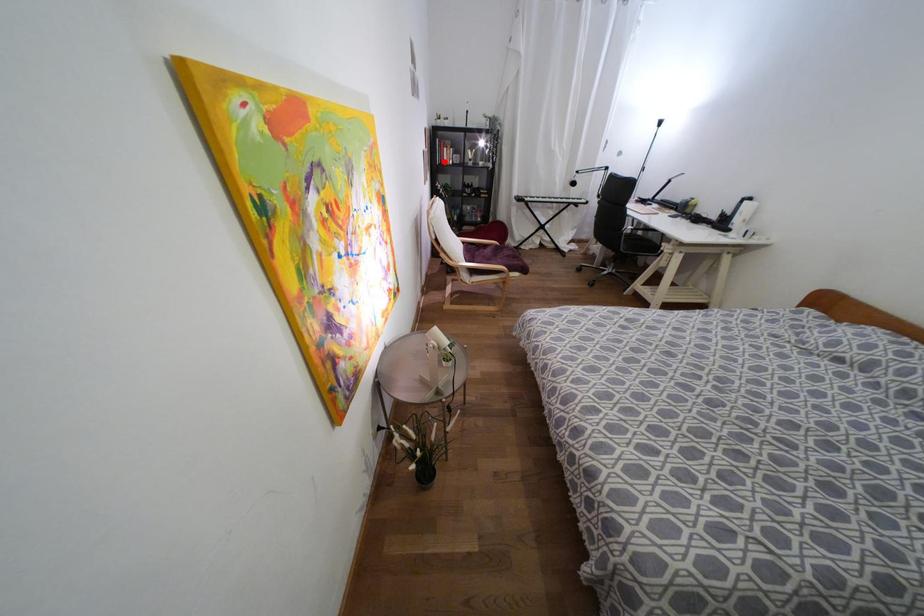
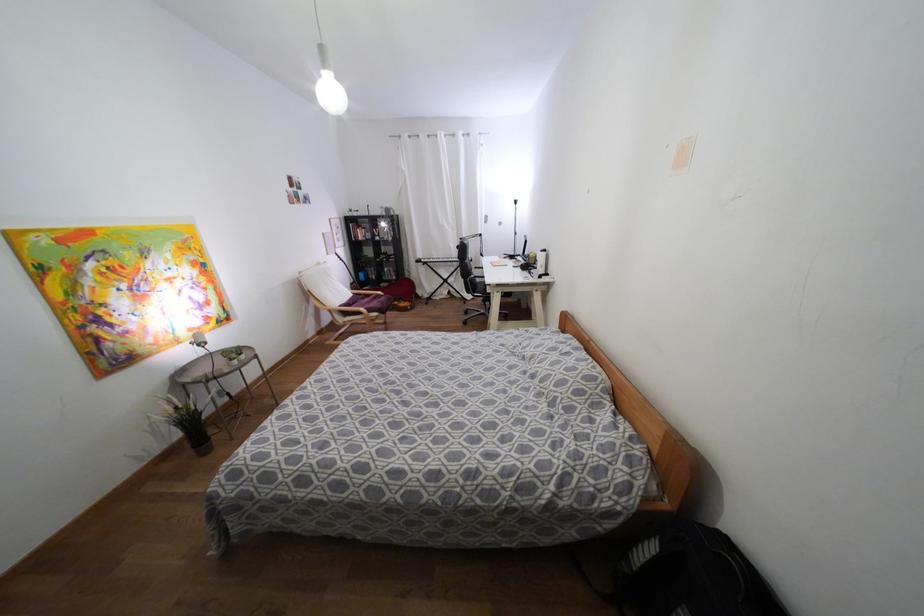
Question: I am providing you with two images of the same scene from different viewpoints. A red point is marked on the first image. At the location where the point appears in image 1, is it still visible in image 2?

Choices:
 (A) Yes
 (B) No

Answer: (A)